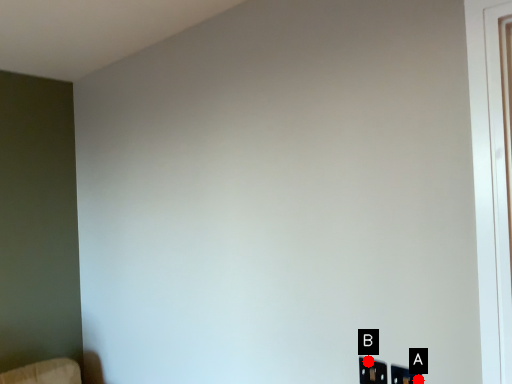
Question: Two points are circled on the image, labeled by A and B beside each circle. Which point is closer to the camera taking this photo?

Choices:
 (A) A is closer
 (B) B is closer

Answer: (A)